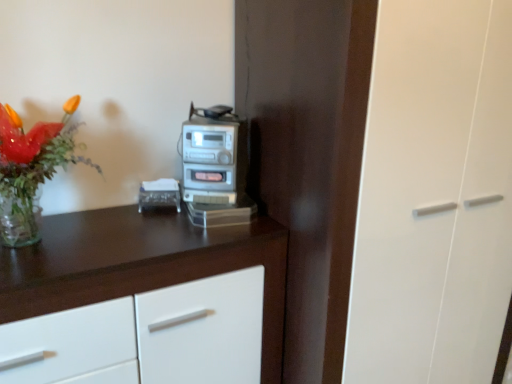
Identify the location of empty space that is in between translucent glass vase at upper left and clear plastic tissue box at center. The width and height of the screenshot is (512, 384). (130, 223).